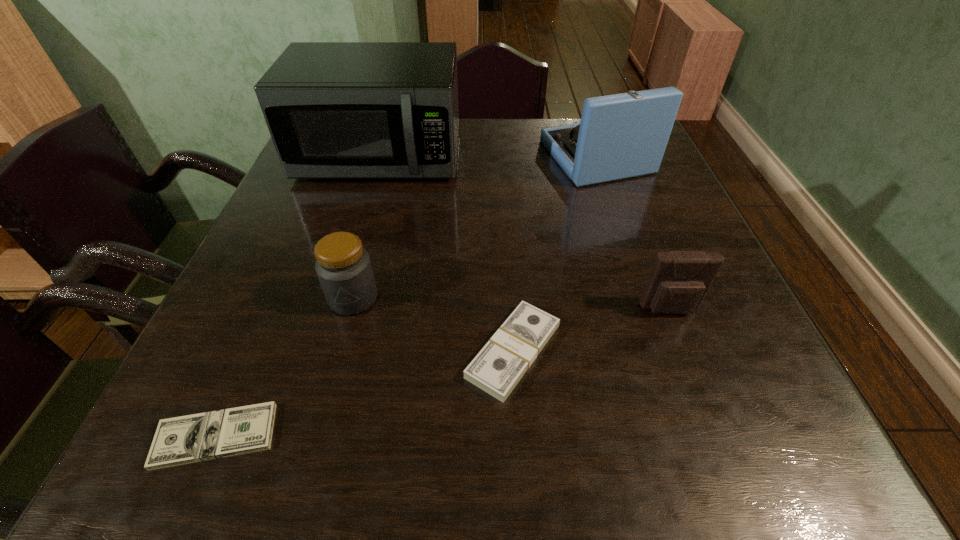
I want to click on free space that is in between the jar and the microwave oven, so [367, 227].

Identify the location of vacant space in between the microwave oven and the shorter dollar. Image resolution: width=960 pixels, height=540 pixels. (298, 296).

I want to click on vacant space that's between the taller dollar and the microwave oven, so click(446, 254).

Where is `free space between the microwave oven and the phonograph record`? The height and width of the screenshot is (540, 960). free space between the microwave oven and the phonograph record is located at coordinates (488, 157).

The height and width of the screenshot is (540, 960). What are the coordinates of `vacant space that's between the nearer dollar and the phonograph record` in the screenshot? It's located at (406, 296).

You are a GUI agent. You are given a task and a screenshot of the screen. Output one action in this format:
    pyautogui.click(x=<x>, y=<y>)
    Task: Click on the free space between the phonograph record and the second shortest object
    This screenshot has width=960, height=540.
    Given the screenshot: What is the action you would take?
    pyautogui.click(x=555, y=254)

I want to click on blank region between the microwave oven and the pouch, so click(525, 233).

I want to click on free space between the pouch and the taller dollar, so click(591, 330).

Point out which object is positioned as the fourth nearest to the right dollar. Please provide its 2D coordinates. Your answer should be formatted as a tuple, i.e. [(x, y)], where the tuple contains the x and y coordinates of a point satisfying the conditions above.

[(335, 110)]

Identify which object is the third nearest to the nearest object. Please provide its 2D coordinates. Your answer should be formatted as a tuple, i.e. [(x, y)], where the tuple contains the x and y coordinates of a point satisfying the conditions above.

[(335, 110)]